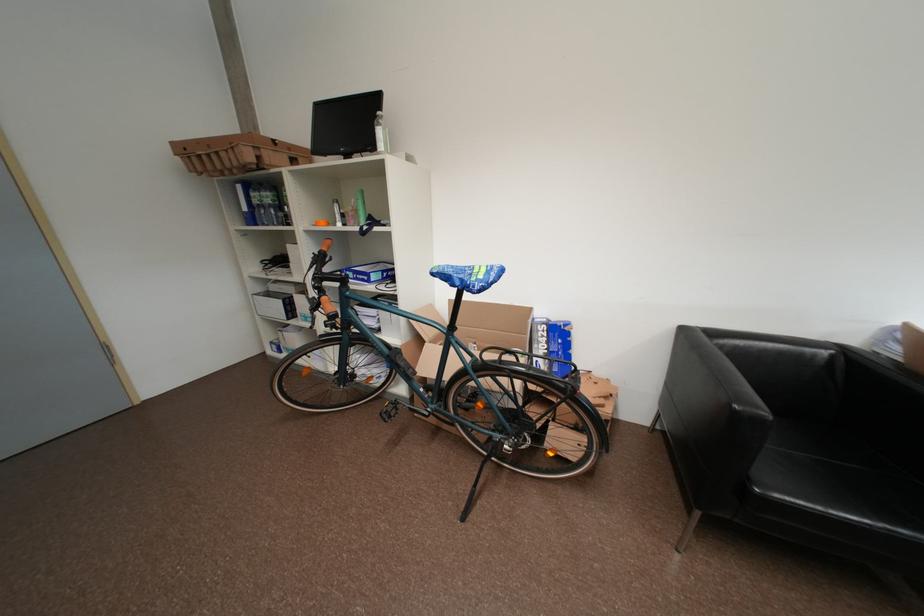
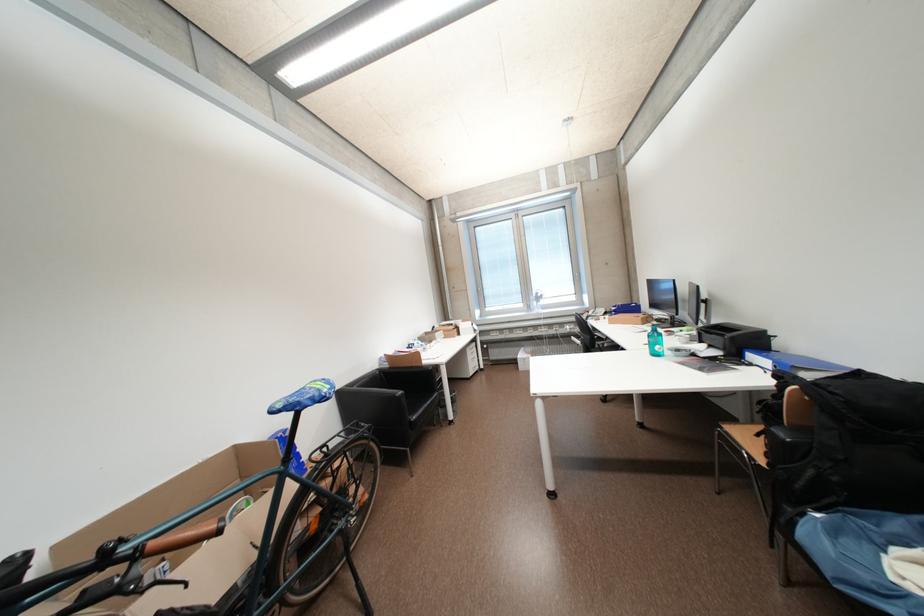
In the second image, find the point that corresponds to (x=774, y=416) in the first image.

(408, 394)